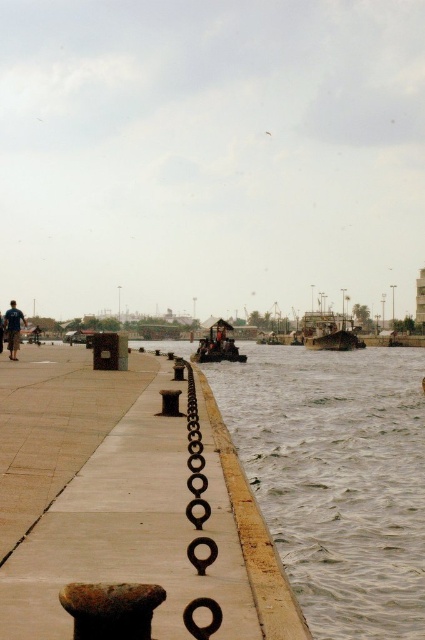
You are standing at the waterfront scene described. You see a point labeled as point [127,502]. What object does this point correspond to?

The point [127,502] corresponds to the rustic concrete pier at center.

You are standing on the concrete walkway and want to locate two points marked in the scene. The first point is at coordinates point (x=252, y=570) and the second is at point (x=209, y=545). Which point is further away from you?

Point (x=252, y=570) is behind point (x=209, y=545), so it is further away from you.